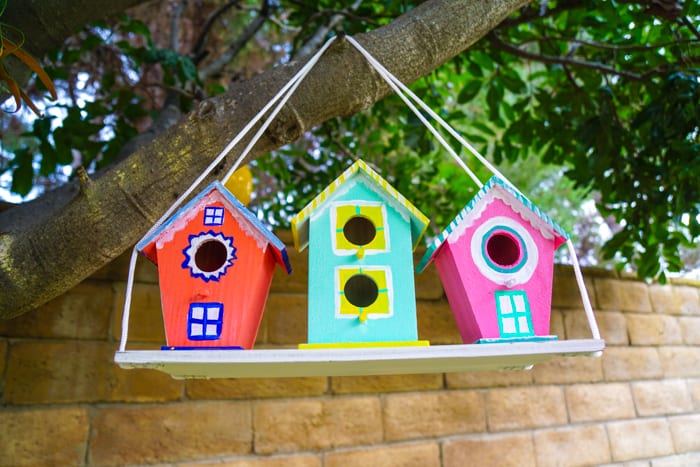
Locate an element on the screen. The image size is (700, 467). white board is located at coordinates (480, 355).